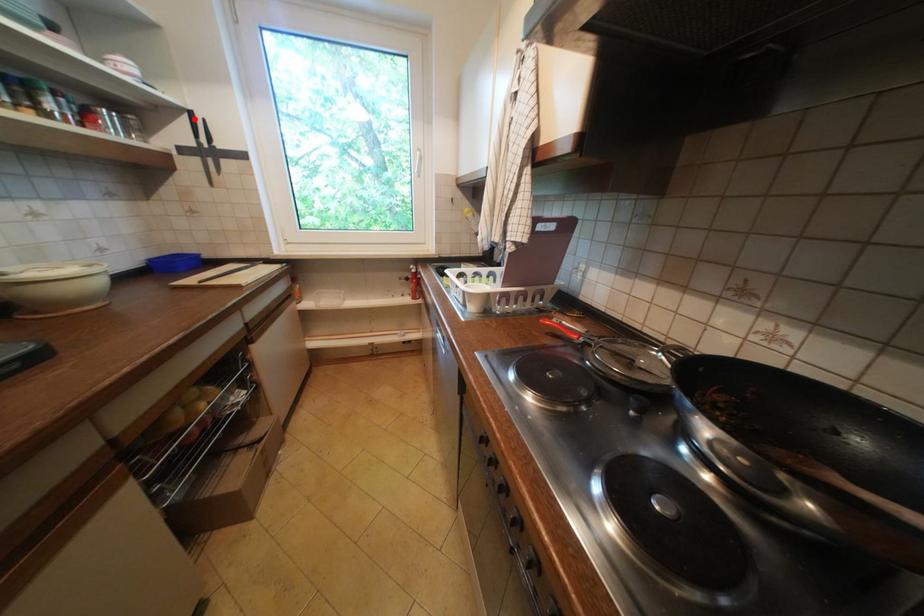
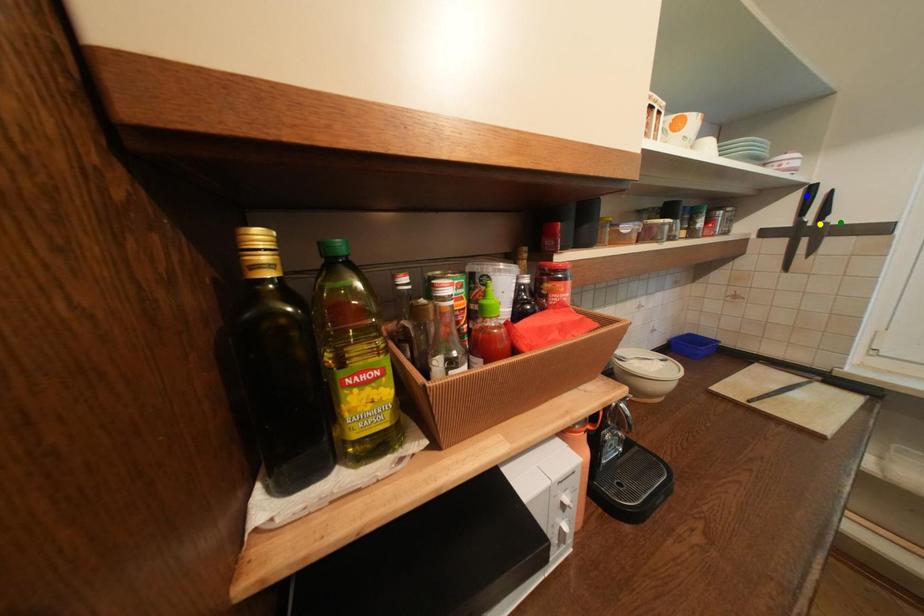
Question: I am providing you with two images of the same scene from different viewpoints. A red point is marked on the first image. You are given multiple points on the second image. Which spot in image 2 lines up with the point in image 1?

Choices:
 (A) yellow point
 (B) blue point
 (C) green point

Answer: (B)